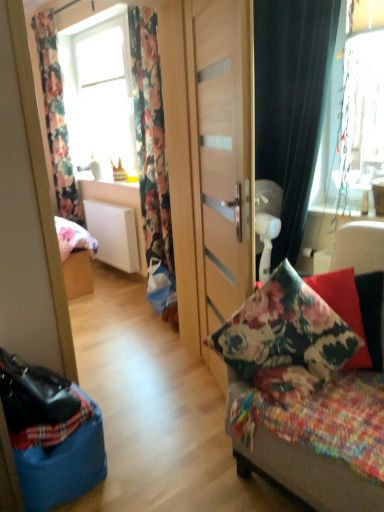
Locate an element on the screen. Image resolution: width=384 pixels, height=512 pixels. vacant area situated to the left side of wooden door at center is located at coordinates (163, 405).